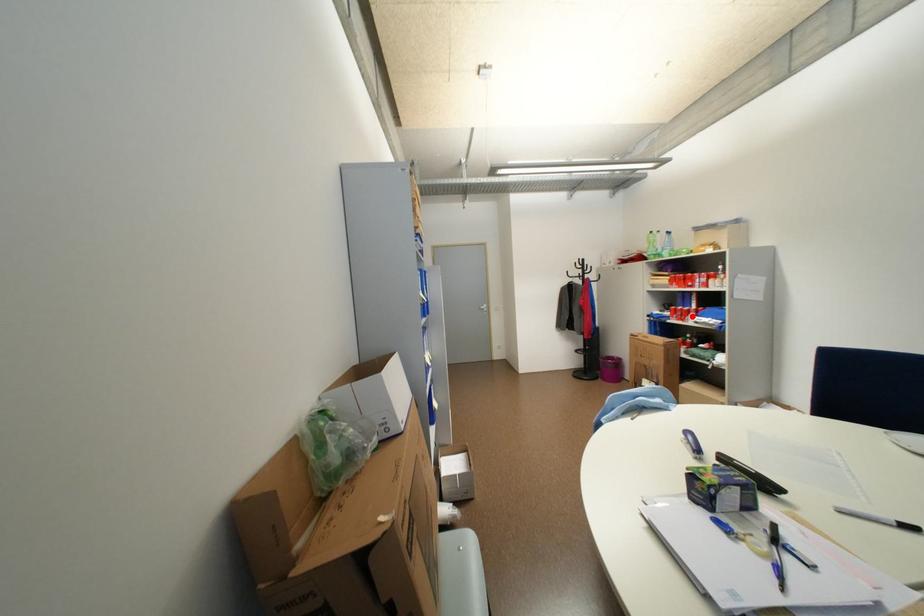
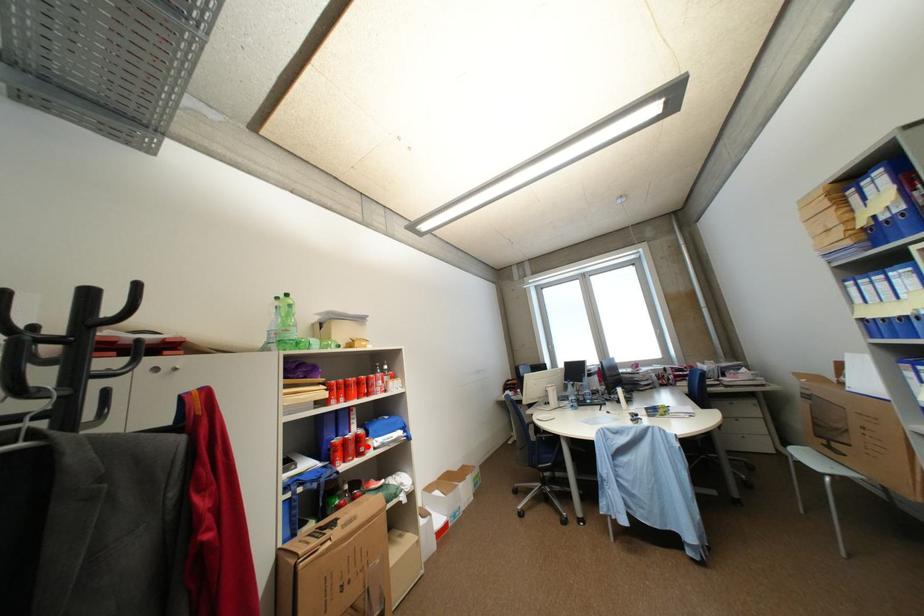
I am providing you with two images of the same scene from different viewpoints. A red point is marked on the first image and another point is marked on the second image. Is the marked point in image1 the same physical position as the marked point in image2?

Yes